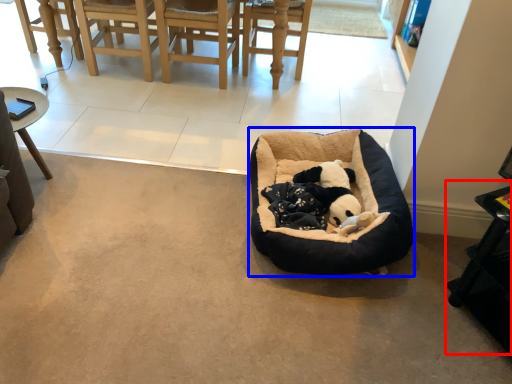
Question: Which object is closer to the camera taking this photo, table (highlighted by a red box) or dog bed (highlighted by a blue box)?

Choices:
 (A) table
 (B) dog bed

Answer: (A)